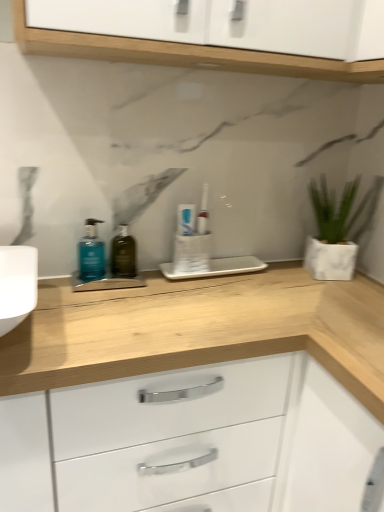
Question: Is white matte pot at right taller or shorter than teal matte pump bottle at left?

Choices:
 (A) tall
 (B) short

Answer: (A)

Question: Relative to teal matte pump bottle at left, is white matte pot at right in front or behind?

Choices:
 (A) behind
 (B) front

Answer: (A)

Question: Estimate the real-world distances between objects in this image. Which object is closer to the white matte pot at right?

Choices:
 (A) green glass bottle at center
 (B) teal matte pump bottle at left
 (C) white glossy toothpaste at center

Answer: (C)

Question: Which of these objects is positioned farthest from the green glass bottle at center?

Choices:
 (A) white matte pot at right
 (B) teal matte pump bottle at left
 (C) white glossy toothpaste at center

Answer: (A)